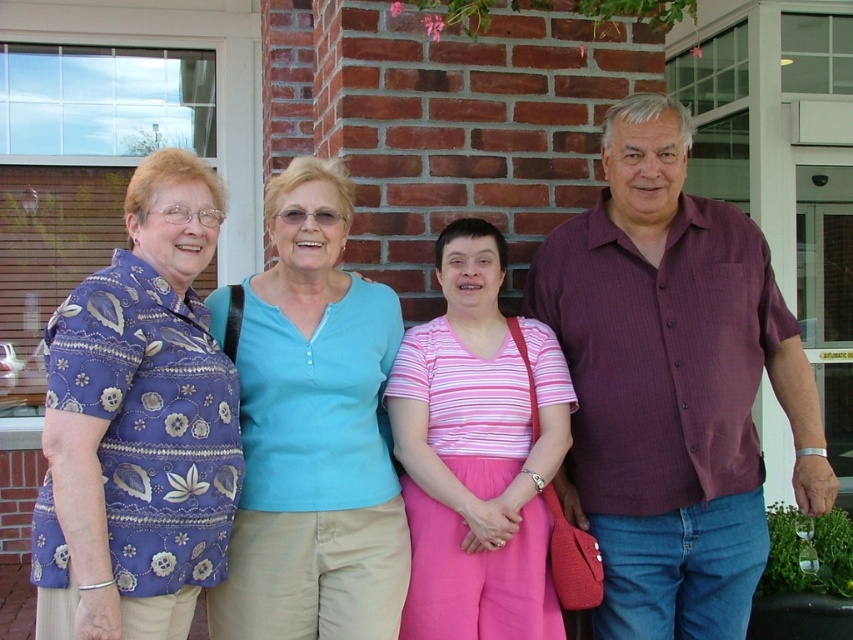
Between point (701, 371) and point (399, 596), which one is positioned in front?

Point (399, 596) is more forward.

Is maroon button-up shirt at right to the right of light blue cotton shirt at center from the viewer's perspective?

Indeed, maroon button-up shirt at right is positioned on the right side of light blue cotton shirt at center.

Does point (572, 257) lie behind point (381, 608)?

Yes, point (572, 257) is farther from viewer.

At what (x,y) coordinates should I click in order to perform the action: click on maroon button-up shirt at right. Please return your answer as a coordinate pair (x, y). The image size is (853, 640). Looking at the image, I should click on (671, 385).

Who is taller, purple floral shirt at left or light blue cotton shirt at center?

light blue cotton shirt at center is taller.

At what (x,y) coordinates should I click in order to perform the action: click on purple floral shirt at left. Please return your answer as a coordinate pair (x, y). Image resolution: width=853 pixels, height=640 pixels. Looking at the image, I should click on (138, 426).

Find the location of a particular element. Image resolution: width=853 pixels, height=640 pixels. purple floral shirt at left is located at coordinates (138, 426).

Is point (96, 554) farther from viewer compared to point (419, 419)?

No, (96, 554) is in front of (419, 419).

Is purple floral shirt at left closer to the viewer compared to pink striped shirt at center?

Yes, purple floral shirt at left is closer to the viewer.

Is point (186, 630) closer to viewer compared to point (527, 451)?

Yes, it is in front of point (527, 451).

The image size is (853, 640). I want to click on purple floral shirt at left, so (x=138, y=426).